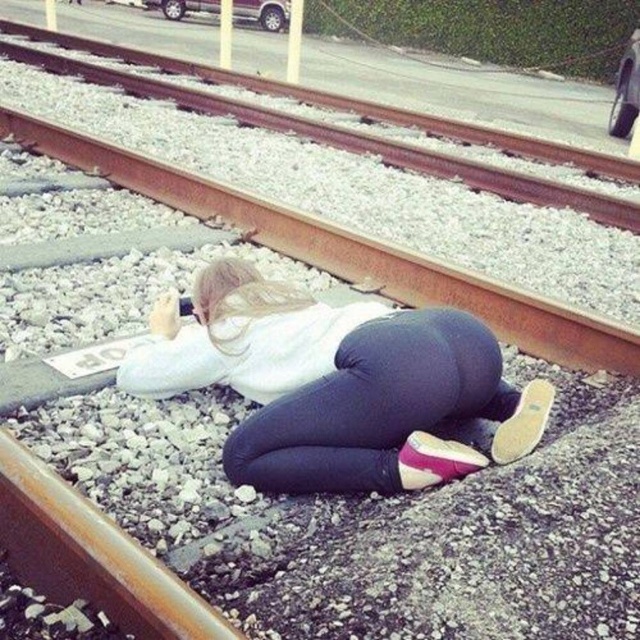
Based on the photo, is white matte shirt at center shorter than rusty metal train track at center?

Incorrect, white matte shirt at center's height does not fall short of rusty metal train track at center's.

Is white matte shirt at center bigger than rusty metal train track at center?

Yes, white matte shirt at center is bigger than rusty metal train track at center.

Is point (268, 323) more distant than point (465, 288)?

No, it is not.

At what (x,y) coordinates should I click in order to perform the action: click on white matte shirt at center. Please return your answer as a coordinate pair (x, y). The image size is (640, 640). Looking at the image, I should click on (340, 387).